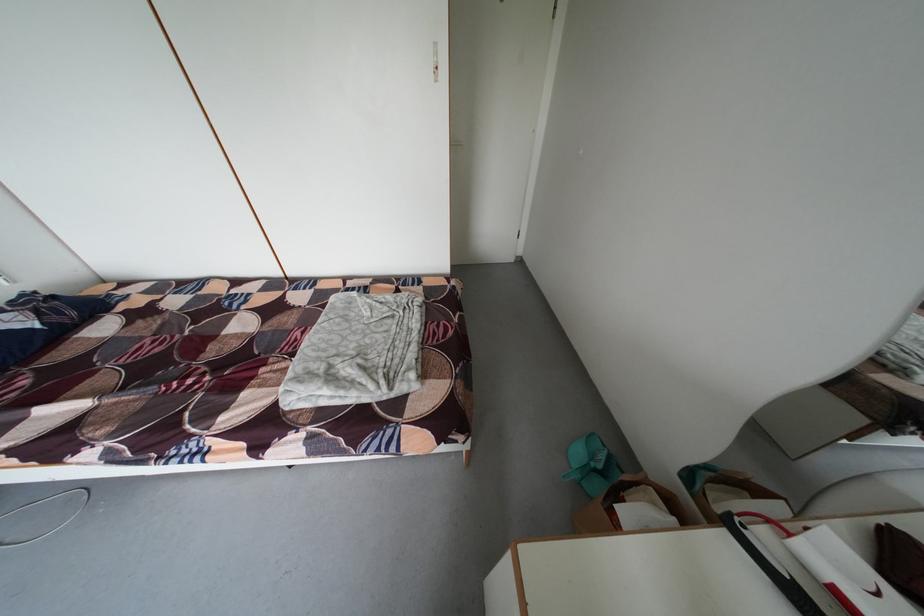
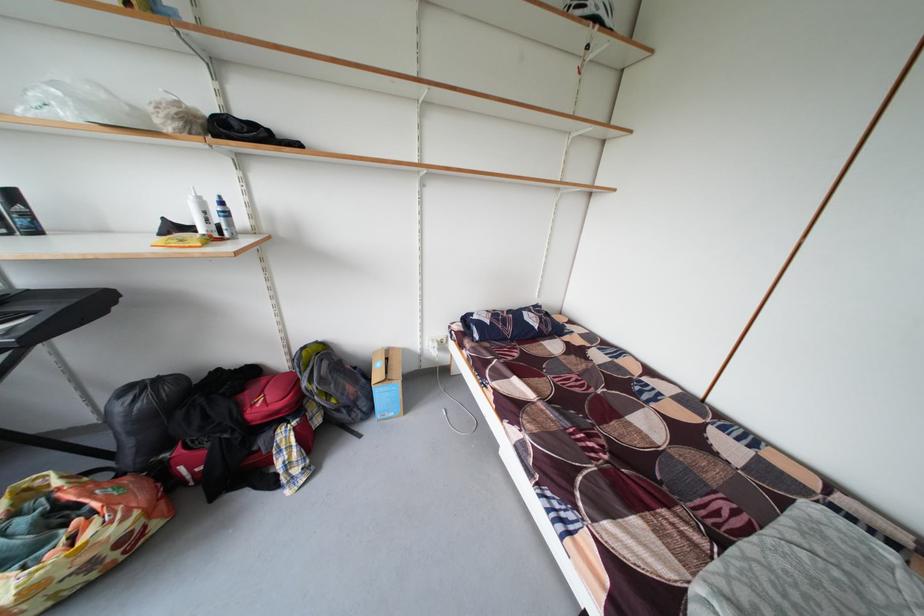
Question: The images are taken continuously from a first-person perspective. In which direction is your viewpoint rotating?

Choices:
 (A) Left
 (B) Right
 (C) Up
 (D) Down

Answer: (A)